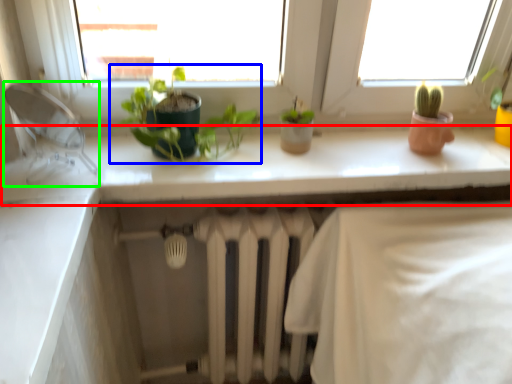
Question: Which is farther away from counter top (highlighted by a red box)? houseplant (highlighted by a blue box) or faucet (highlighted by a green box)?

Choices:
 (A) houseplant
 (B) faucet

Answer: (B)